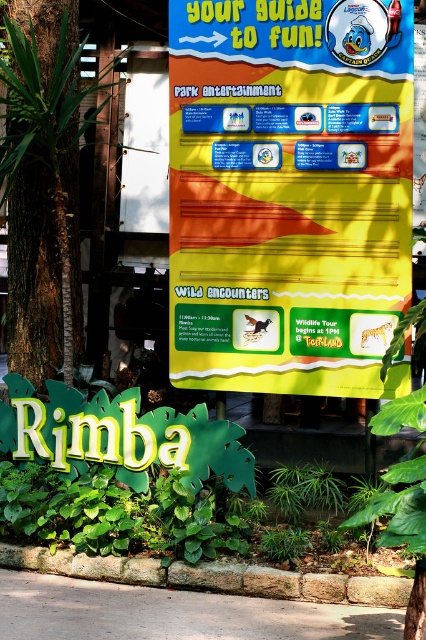
Question: Among these points, which one is farthest from the camera?

Choices:
 (A) (11, 88)
 (B) (279, 120)

Answer: (A)

Question: Can you confirm if yellow paper sign at center is positioned below green bark tree at left?

Choices:
 (A) no
 (B) yes

Answer: (B)

Question: Among these points, which one is farthest from the camera?

Choices:
 (A) (31, 109)
 (B) (391, 88)

Answer: (A)

Question: Is yellow paper sign at center smaller than green bark tree at left?

Choices:
 (A) no
 (B) yes

Answer: (B)

Question: Is yellow paper sign at center positioned behind green bark tree at left?

Choices:
 (A) no
 (B) yes

Answer: (A)

Question: Which point is farther from the camera taking this photo?

Choices:
 (A) (48, 280)
 (B) (199, 358)

Answer: (A)